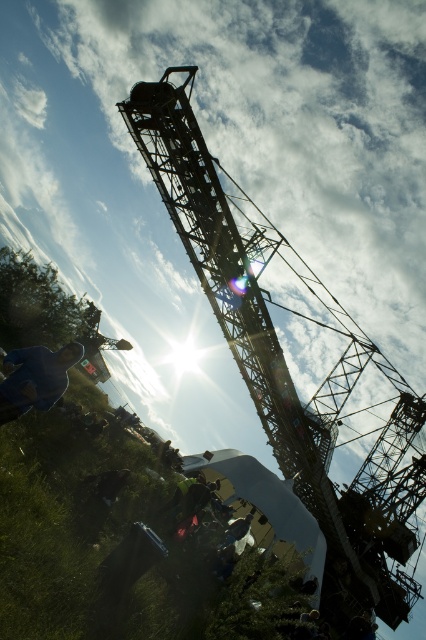
You are standing at the point labeled point (8, 374) and want to walk to the point labeled point (221, 212). Which direction should you face to walk towards your destination?

You should face north to walk towards point (221, 212) from point (8, 374).

You are a photographer trying to capture a clear shot of the metallic structure at center without any obstructions. However, there is a person wearing a blue fabric jacket at lower left in the scene. Based on their positions, can you adjust your angle to avoid the jacket?

The metallic structure at center is in front of the blue fabric jacket at lower left, so adjusting your angle slightly to focus on the metallic structure at center should allow you to avoid the jacket as it is behind the structure.